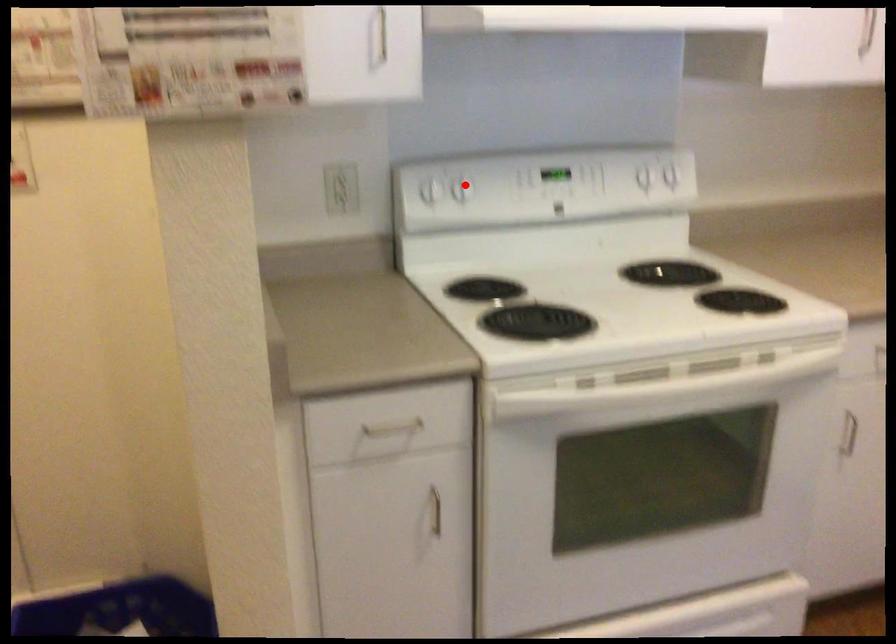
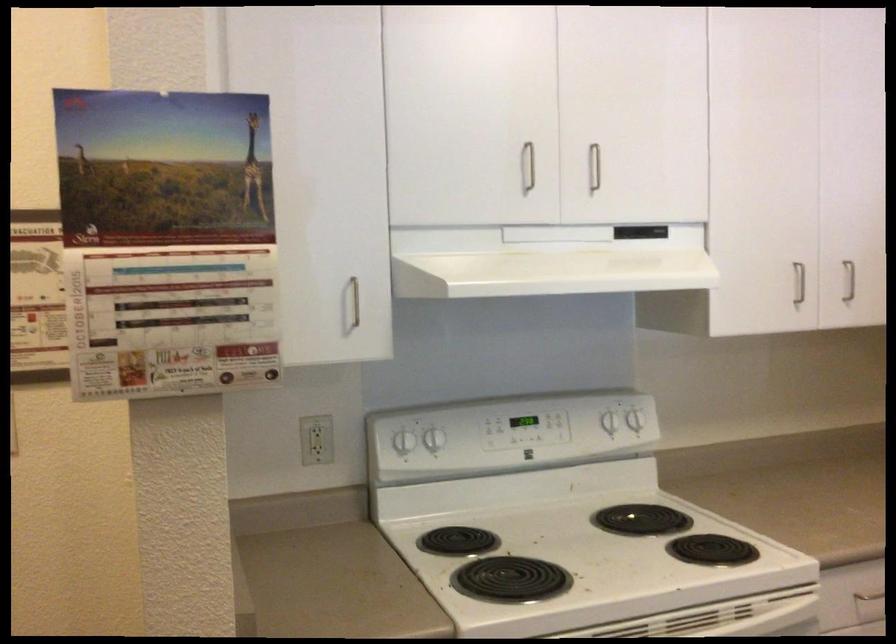
In the second image, find the point that corresponds to the highlighted location in the first image.

(435, 439)